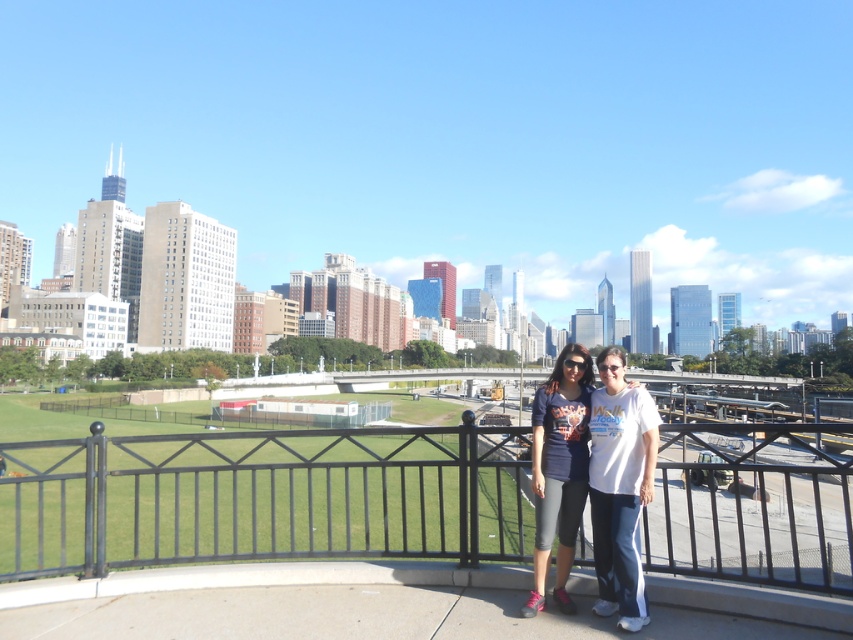
Which is more to the left, black metal fence at center or matte blue shirt at center?

From the viewer's perspective, black metal fence at center appears more on the left side.

Does black metal fence at center appear on the right side of matte blue shirt at center?

Incorrect, black metal fence at center is not on the right side of matte blue shirt at center.

Which is in front, point (80, 573) or point (621, 532)?

Positioned in front is point (621, 532).

Identify the location of black metal fence at center. Image resolution: width=853 pixels, height=640 pixels. (263, 497).